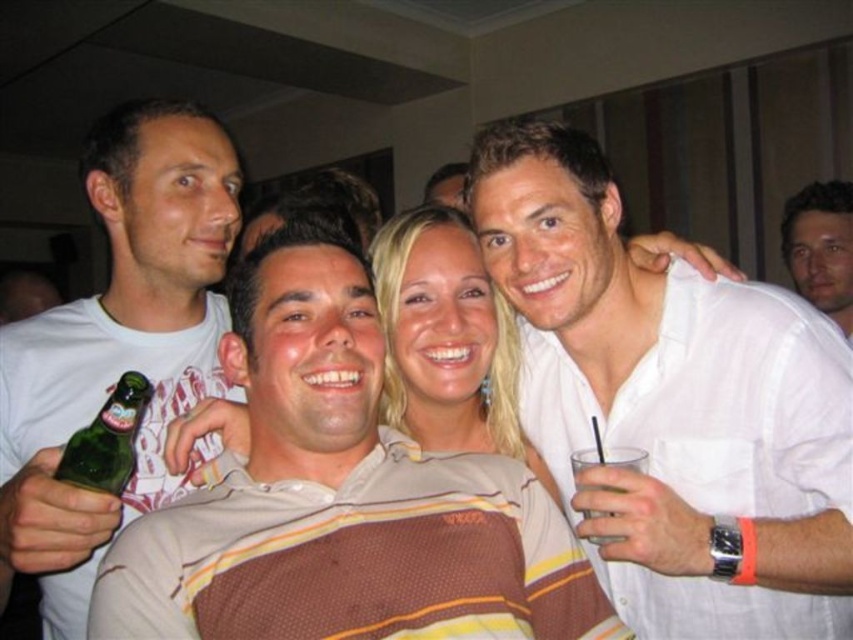
Which of these two, white matte t-shirt at left or green glass bottle at lower left, stands taller?

white matte t-shirt at left

Between white matte t-shirt at left and green glass bottle at lower left, which one has less height?

With less height is green glass bottle at lower left.

Measure the distance between white matte t-shirt at left and camera.

The distance of white matte t-shirt at left from camera is 29.77 inches.

At what (x,y) coordinates should I click in order to perform the action: click on white matte t-shirt at left. Please return your answer as a coordinate pair (x, y). The width and height of the screenshot is (853, 640). Looking at the image, I should click on (117, 342).

Does matte white shirt at upper right have a lesser height compared to clear plastic cup at upper right?

In fact, matte white shirt at upper right may be taller than clear plastic cup at upper right.

Is matte white shirt at upper right bigger than clear plastic cup at upper right?

Correct, matte white shirt at upper right is larger in size than clear plastic cup at upper right.

At what (x,y) coordinates should I click in order to perform the action: click on matte white shirt at upper right. Please return your answer as a coordinate pair (x, y). This screenshot has height=640, width=853. Looking at the image, I should click on (821, 248).

You are a GUI agent. You are given a task and a screenshot of the screen. Output one action in this format:
    pyautogui.click(x=<x>, y=<y>)
    Task: Click on the matte white shirt at upper right
    
    Given the screenshot: What is the action you would take?
    [821, 248]

Between blonde hair at center and green glass bottle at lower left, which one appears on the left side from the viewer's perspective?

From the viewer's perspective, green glass bottle at lower left appears more on the left side.

Is blonde hair at center above green glass bottle at lower left?

Incorrect, blonde hair at center is not positioned above green glass bottle at lower left.

Image resolution: width=853 pixels, height=640 pixels. In order to click on blonde hair at center in this screenshot , I will do click(448, 340).